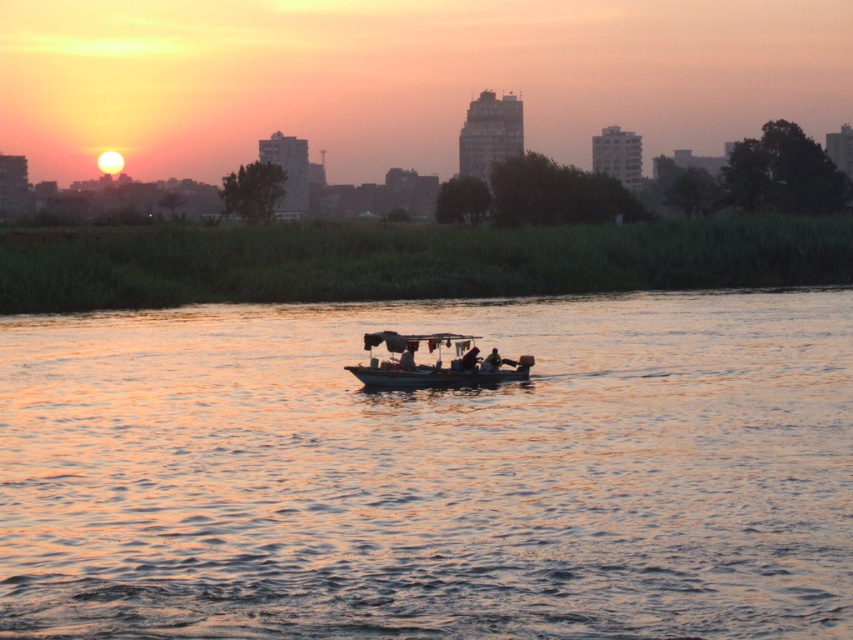
You are standing on the shore observing the sunset scene. Which object, the smooth water at center or the metallic gray boat at center, is nearer to you?

The smooth water at center is closer to the viewer than the metallic gray boat at center, so the smooth water at center is nearer to you.

You are an observer standing on the lakeside watching the sunset. You see the smooth water at center and the metallic gray boat at center. Which object appears taller from your perspective?

The smooth water at center appears taller than the metallic gray boat at center from your perspective.

You are an observer standing on the shore looking at the scene. Which object is closer to you between the smooth water at center and the metallic gray boat at center?

The smooth water at center is positioned over the metallic gray boat at center, meaning the boat is beneath the water from your viewpoint. Therefore, the smooth water at center is closer to you.